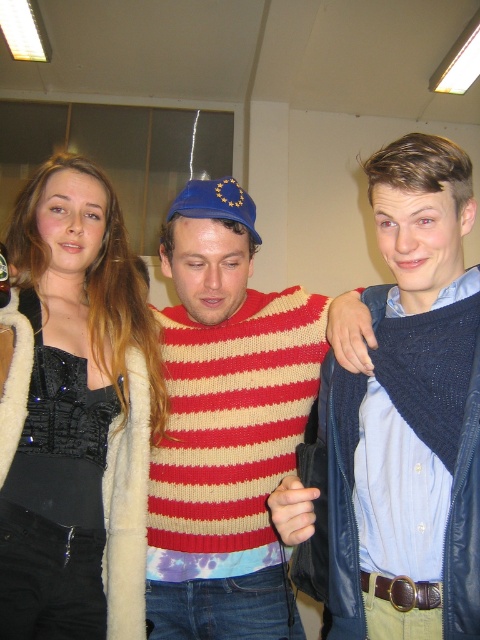
Is cable-knit sweater at right taller than knitted wool sweater at center?

No.

What do you see at coordinates (399, 420) in the screenshot? I see `cable-knit sweater at right` at bounding box center [399, 420].

Measure the distance between point (458, 284) and camera.

The distance of point (458, 284) from camera is 3.29 feet.

This screenshot has width=480, height=640. Identify the location of cable-knit sweater at right. (399, 420).

Can you confirm if knitted wool sweater at center is wider than black sequined top at left?

Indeed, knitted wool sweater at center has a greater width compared to black sequined top at left.

Which is more to the right, knitted wool sweater at center or black sequined top at left?

knitted wool sweater at center is more to the right.

In order to click on knitted wool sweater at center in this screenshot , I will do `click(226, 426)`.

Which is more to the left, cable-knit sweater at right or black sequined top at left?

black sequined top at left is more to the left.

Is point (456, 228) more distant than point (99, 636)?

No, (456, 228) is closer to viewer.

Who is more forward, (339,499) or (68,262)?

Positioned in front is point (339,499).

This screenshot has width=480, height=640. Identify the location of cable-knit sweater at right. (399, 420).